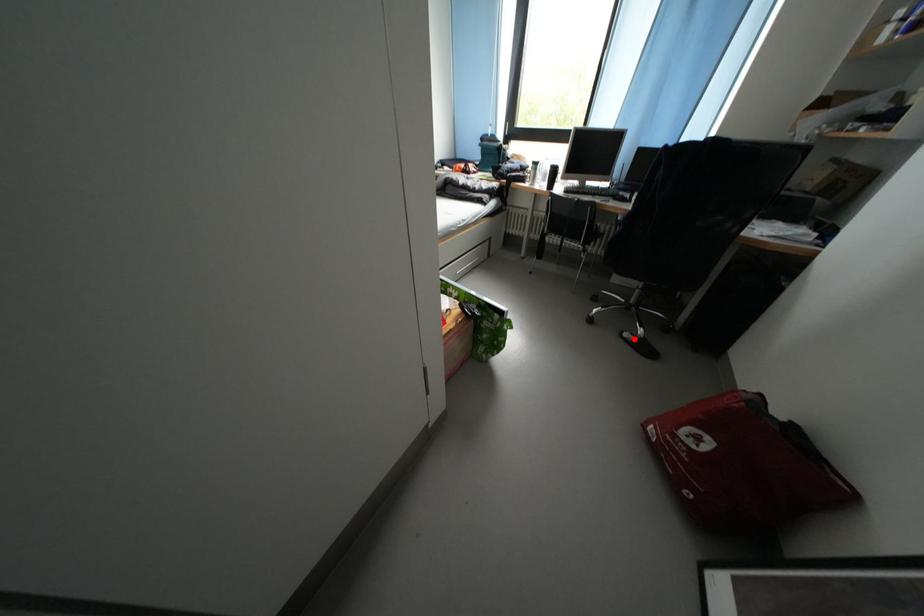
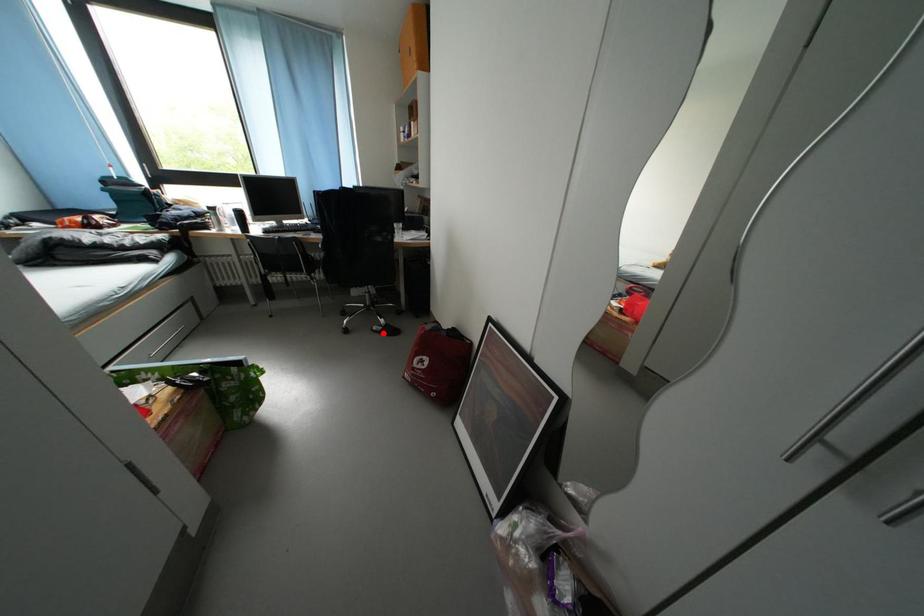
I am providing you with two images of the same scene from different viewpoints. A red point is marked on the first image and another point is marked on the second image. Are the points marked in image1 and image2 representing the same 3D position?

Yes